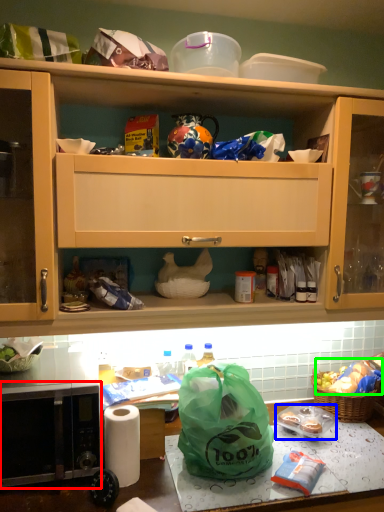
Question: Considering the real-world distances, which object is farthest from microwave oven (highlighted by a red box)? food (highlighted by a blue box) or food (highlighted by a green box)?

Choices:
 (A) food
 (B) food

Answer: (B)